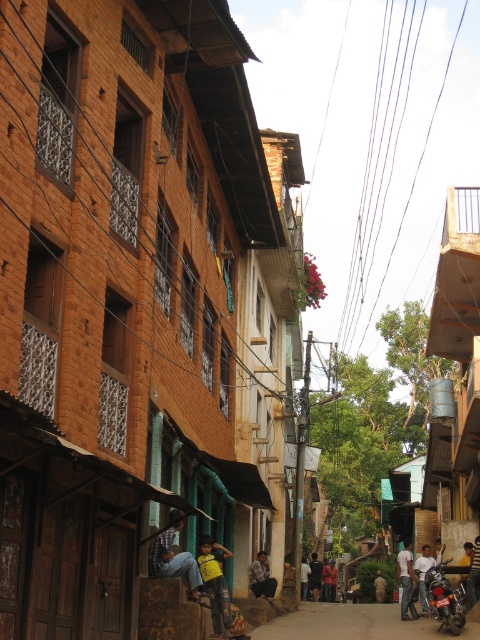
Question: Which object is the closest to the camouflage fabric jacket at center?

Choices:
 (A) yellow jersey at center
 (B) dark gray asphalt at center

Answer: (B)

Question: Is the position of denim jeans at center less distant than that of yellow jersey at center?

Choices:
 (A) yes
 (B) no

Answer: (A)

Question: In this image, where is dark gray asphalt at center located relative to denim jeans at center?

Choices:
 (A) below
 (B) above

Answer: (A)

Question: Is dark gray asphalt at center closer to the viewer compared to dark blue shirt at center?

Choices:
 (A) yes
 (B) no

Answer: (A)

Question: Which point is farther to the camera?

Choices:
 (A) (261, 556)
 (B) (165, 547)
 (C) (408, 541)
 (D) (451, 612)

Answer: (C)

Question: Which is farther from the yellow jersey at center?

Choices:
 (A) dark gray asphalt at center
 (B) dark blue shirt at center

Answer: (B)